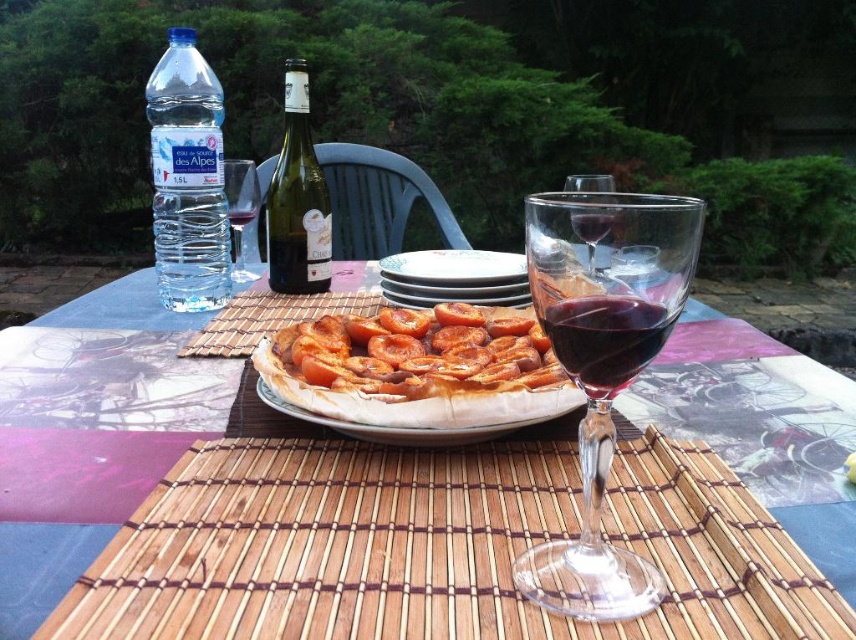
You are a guest at the outdoor dining setup. You want to reach for the golden brown crusty pie at center without knocking over the transparent glass wine glass at center. Is this possible based on their positions?

The transparent glass wine glass at center is positioned under the golden brown crusty pie at center, so reaching for the pie might cause the wine glass to tip over. Exercise caution to avoid contact.

You are setting up a table for a dinner party and need to arrange the green glass wine bottle at center and white ceramic plates at center. Which item has a smaller width?

The green glass wine bottle at center has a lesser width compared to the white ceramic plates at center, so the green glass wine bottle at center is smaller in width.

You are setting up a table for a dinner party and want to ensure that the transparent glass wine glass at center and the golden brown crusty pie at center are arranged properly. Which object takes up more space on the table?

The golden brown crusty pie at center takes up more space on the table because it is larger than the transparent glass wine glass at center.